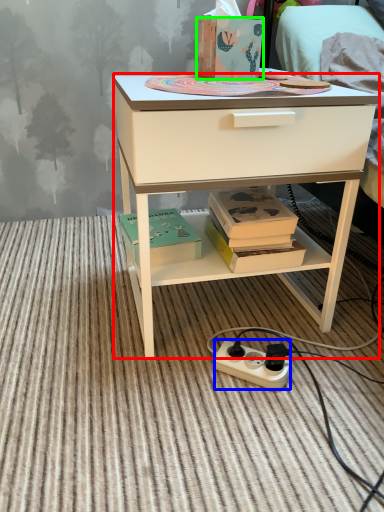
Question: Considering the real-world distances, which object is farthest from desk (highlighted by a red box)? power outlet (highlighted by a blue box) or box (highlighted by a green box)?

Choices:
 (A) power outlet
 (B) box

Answer: (A)